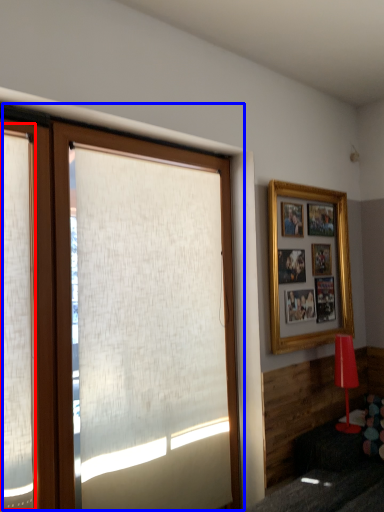
Question: Which of the following is the farthest to the observer, shutter (highlighted by a red box) or window (highlighted by a blue box)?

Choices:
 (A) shutter
 (B) window

Answer: (B)